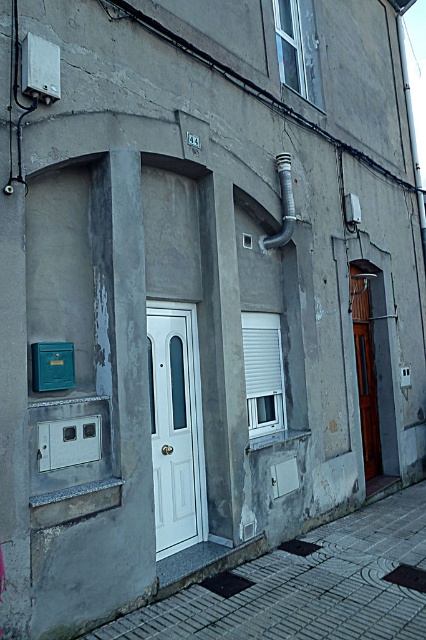
You are standing in front of the building facade and want to locate two points marked on the image. The first point is at coordinates point (x=161, y=464) and the second is at point (x=48, y=372). Which point is closer to you?

Point (x=48, y=372) is closer to you because it is in front of point (x=161, y=464).